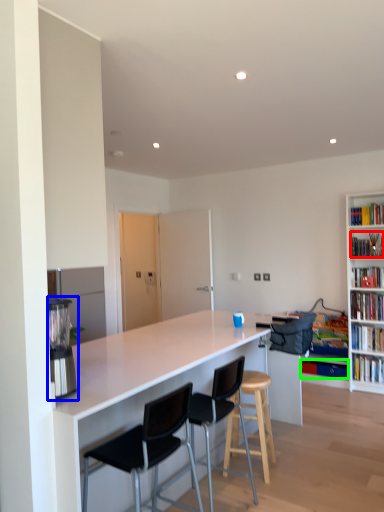
Question: Estimate the real-world distances between objects in this image. Which object is farther from book (highlighted by a red box), appliance (highlighted by a blue box) or book (highlighted by a green box)?

Choices:
 (A) appliance
 (B) book

Answer: (A)